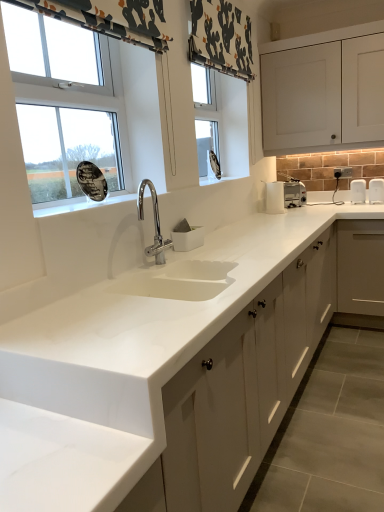
What do you see at coordinates (71, 106) in the screenshot?
I see `white glossy window at upper left` at bounding box center [71, 106].

Locate an element on the screen. The image size is (384, 512). white matte cabinet at upper right, the first cabinetry from the top is located at coordinates click(x=323, y=90).

The height and width of the screenshot is (512, 384). I want to click on patterned fabric curtain at upper left, so click(110, 18).

You are a GUI agent. You are given a task and a screenshot of the screen. Output one action in this format:
    pyautogui.click(x=<x>, y=<y>)
    Task: Click on the white matte cabinet at center, placed as the 1th cabinetry when sorted from bottom to top
    The height and width of the screenshot is (512, 384).
    Given the screenshot: What is the action you would take?
    pyautogui.click(x=245, y=385)

From a real-world perspective, is white matte cabinet at center, placed as the 1th cabinetry when sorted from bottom to top, physically above white matte cabinet at upper right, the first cabinetry from the top?

No, from a real-world perspective, white matte cabinet at center, placed as the 1th cabinetry when sorted from bottom to top, is not on top of white matte cabinet at upper right, the first cabinetry from the top.

Is point (290, 300) farther from viewer compared to point (365, 59)?

That is False.

Is white matte cabinet at center, which is the second cabinetry from top to bottom, not close to white matte cabinet at upper right, the first cabinetry from the top?

white matte cabinet at center, which is the second cabinetry from top to bottom, is far away from white matte cabinet at upper right, the first cabinetry from the top.

Is white matte cabinet at center, placed as the 1th cabinetry when sorted from bottom to top, taller or shorter than white matte cabinet at upper right, which appears as the second cabinetry when ordered from the bottom?

Clearly, white matte cabinet at center, placed as the 1th cabinetry when sorted from bottom to top, is taller compared to white matte cabinet at upper right, which appears as the second cabinetry when ordered from the bottom.

Considering the relative sizes of white matte cabinet at upper right, the first cabinetry from the top, and patterned fabric curtain at upper left in the image provided, is white matte cabinet at upper right, the first cabinetry from the top, wider than patterned fabric curtain at upper left?

Yes, white matte cabinet at upper right, the first cabinetry from the top, is wider than patterned fabric curtain at upper left.

Where is `curtain below the white matte cabinet at upper right, which appears as the second cabinetry when ordered from the bottom (from the image's perspective)`? This screenshot has width=384, height=512. curtain below the white matte cabinet at upper right, which appears as the second cabinetry when ordered from the bottom (from the image's perspective) is located at coordinates (110, 18).

Is point (313, 149) closer to viewer compared to point (162, 8)?

No, (313, 149) is further to viewer.

Based on the photo, is white matte cabinet at center, which is the second cabinetry from top to bottom, inside white glossy window at upper left?

Actually, white matte cabinet at center, which is the second cabinetry from top to bottom, is outside white glossy window at upper left.

Consider the image. Is white matte cabinet at center, placed as the 1th cabinetry when sorted from bottom to top, at the back of white glossy window at upper left?

No, white glossy window at upper left's orientation is not away from white matte cabinet at center, placed as the 1th cabinetry when sorted from bottom to top.

Which is in front, point (29, 45) or point (306, 326)?

Point (29, 45)

Is white matte cabinet at center, placed as the 1th cabinetry when sorted from bottom to top, to the left of patterned fabric curtain at upper left from the viewer's perspective?

Incorrect, white matte cabinet at center, placed as the 1th cabinetry when sorted from bottom to top, is not on the left side of patterned fabric curtain at upper left.

Can you confirm if white matte cabinet at center, placed as the 1th cabinetry when sorted from bottom to top, is bigger than patterned fabric curtain at upper left?

Correct, white matte cabinet at center, placed as the 1th cabinetry when sorted from bottom to top, is larger in size than patterned fabric curtain at upper left.

Is white matte cabinet at center, placed as the 1th cabinetry when sorted from bottom to top, positioned before patterned fabric curtain at upper left?

No, white matte cabinet at center, placed as the 1th cabinetry when sorted from bottom to top, is further to the viewer.

Is patterned fabric curtain at upper left completely or partially inside white matte cabinet at center, which is the second cabinetry from top to bottom?

No.

Image resolution: width=384 pixels, height=512 pixels. What are the coordinates of `cabinetry above the white glossy window at upper left (from the image's perspective)` in the screenshot? It's located at (323, 90).

From a real-world perspective, which is physically below, white matte cabinet at upper right, the first cabinetry from the top, or white glossy window at upper left?

From a 3D spatial view, white glossy window at upper left is below.

Between white matte cabinet at upper right, which appears as the second cabinetry when ordered from the bottom, and white glossy window at upper left, which one is positioned in front?

white glossy window at upper left.

In the scene shown: From the image's perspective, would you say white matte cabinet at upper right, the first cabinetry from the top, is shown under white glossy window at upper left?

Incorrect, from the image's perspective, white matte cabinet at upper right, the first cabinetry from the top, is higher than white glossy window at upper left.

Which object is thinner, white glossy window at upper left or white matte cabinet at upper right, the first cabinetry from the top?

Thinner between the two is white glossy window at upper left.

From a real-world perspective, is white glossy window at upper left physically below white matte cabinet at upper right, which appears as the second cabinetry when ordered from the bottom?

Yes, from a real-world perspective, white glossy window at upper left is below white matte cabinet at upper right, which appears as the second cabinetry when ordered from the bottom.

Can you confirm if white glossy window at upper left is bigger than white matte cabinet at upper right, which appears as the second cabinetry when ordered from the bottom?

No.

Where is `window below the white matte cabinet at upper right, the first cabinetry from the top (from the image's perspective)`? The width and height of the screenshot is (384, 512). window below the white matte cabinet at upper right, the first cabinetry from the top (from the image's perspective) is located at coordinates (71, 106).

In the scene shown: From the image's perspective, which one is positioned higher, patterned fabric curtain at upper left or white glossy window at upper left?

From the image's view, patterned fabric curtain at upper left is above.

Which object is further away from the camera taking this photo, patterned fabric curtain at upper left or white glossy window at upper left?

white glossy window at upper left is more distant.

Is patterned fabric curtain at upper left bigger than white glossy window at upper left?

Incorrect, patterned fabric curtain at upper left is not larger than white glossy window at upper left.

Is patterned fabric curtain at upper left next to white glossy window at upper left and touching it?

patterned fabric curtain at upper left and white glossy window at upper left are clearly separated.

Locate an element on the screen. cabinetry that appears below the white matte cabinet at upper right, which appears as the second cabinetry when ordered from the bottom (from a real-world perspective) is located at coordinates (245, 385).

Locate an element on the screen. curtain in front of the white matte cabinet at upper right, the first cabinetry from the top is located at coordinates click(110, 18).

Considering their positions, is patterned fabric curtain at upper left positioned closer to white matte cabinet at center, which is the second cabinetry from top to bottom, than white glossy window at upper left?

white glossy window at upper left is closer to white matte cabinet at center, which is the second cabinetry from top to bottom.

Looking at the image, which one is located closer to white matte cabinet at upper right, which appears as the second cabinetry when ordered from the bottom, patterned fabric curtain at upper left or white matte cabinet at center, which is the second cabinetry from top to bottom?

The object closer to white matte cabinet at upper right, which appears as the second cabinetry when ordered from the bottom, is white matte cabinet at center, which is the second cabinetry from top to bottom.

When comparing their distances from white glossy window at upper left, does white matte cabinet at upper right, the first cabinetry from the top, or patterned fabric curtain at upper left seem further?

white matte cabinet at upper right, the first cabinetry from the top, lies further to white glossy window at upper left than the other object.

Based on their spatial positions, is patterned fabric curtain at upper left or white matte cabinet at upper right, the first cabinetry from the top, closer to white matte cabinet at center, which is the second cabinetry from top to bottom?

The object closer to white matte cabinet at center, which is the second cabinetry from top to bottom, is patterned fabric curtain at upper left.

Looking at the image, which one is located further to white glossy window at upper left, white matte cabinet at upper right, which appears as the second cabinetry when ordered from the bottom, or white matte cabinet at center, placed as the 1th cabinetry when sorted from bottom to top?

white matte cabinet at upper right, which appears as the second cabinetry when ordered from the bottom, is positioned further to the anchor white glossy window at upper left.

From the image, which object appears to be nearer to white glossy window at upper left, white matte cabinet at center, which is the second cabinetry from top to bottom, or white matte cabinet at upper right, which appears as the second cabinetry when ordered from the bottom?

Based on the image, white matte cabinet at center, which is the second cabinetry from top to bottom, appears to be nearer to white glossy window at upper left.

Based on their spatial positions, is white glossy window at upper left or white matte cabinet at center, which is the second cabinetry from top to bottom, closer to patterned fabric curtain at upper left?

Among the two, white glossy window at upper left is located nearer to patterned fabric curtain at upper left.

Looking at the image, which one is located further to patterned fabric curtain at upper left, white glossy window at upper left or white matte cabinet at upper right, the first cabinetry from the top?

white matte cabinet at upper right, the first cabinetry from the top, is positioned further to the anchor patterned fabric curtain at upper left.

At what (x,y) coordinates should I click in order to perform the action: click on window between patterned fabric curtain at upper left and white matte cabinet at upper right, which appears as the second cabinetry when ordered from the bottom, from front to back. Please return your answer as a coordinate pair (x, y). The image size is (384, 512). Looking at the image, I should click on (71, 106).

This screenshot has width=384, height=512. Find the location of `cabinetry between patterned fabric curtain at upper left and white matte cabinet at upper right, which appears as the second cabinetry when ordered from the bottom, from front to back`. cabinetry between patterned fabric curtain at upper left and white matte cabinet at upper right, which appears as the second cabinetry when ordered from the bottom, from front to back is located at coordinates (245, 385).

This screenshot has height=512, width=384. Identify the location of curtain between white glossy window at upper left and white matte cabinet at center, placed as the 1th cabinetry when sorted from bottom to top, from left to right. (110, 18).

This screenshot has width=384, height=512. I want to click on cabinetry between white glossy window at upper left and white matte cabinet at upper right, the first cabinetry from the top, from front to back, so click(245, 385).